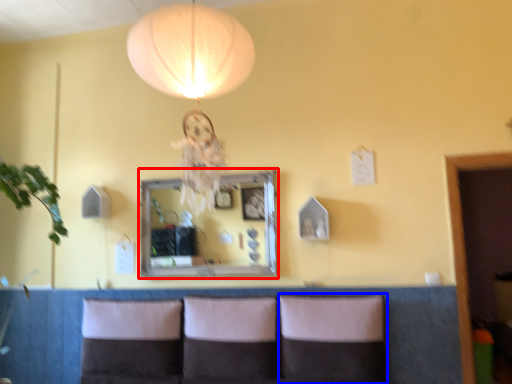
Question: Which object appears farthest to the camera in this image, mirror (highlighted by a red box) or pillow (highlighted by a blue box)?

Choices:
 (A) mirror
 (B) pillow

Answer: (A)